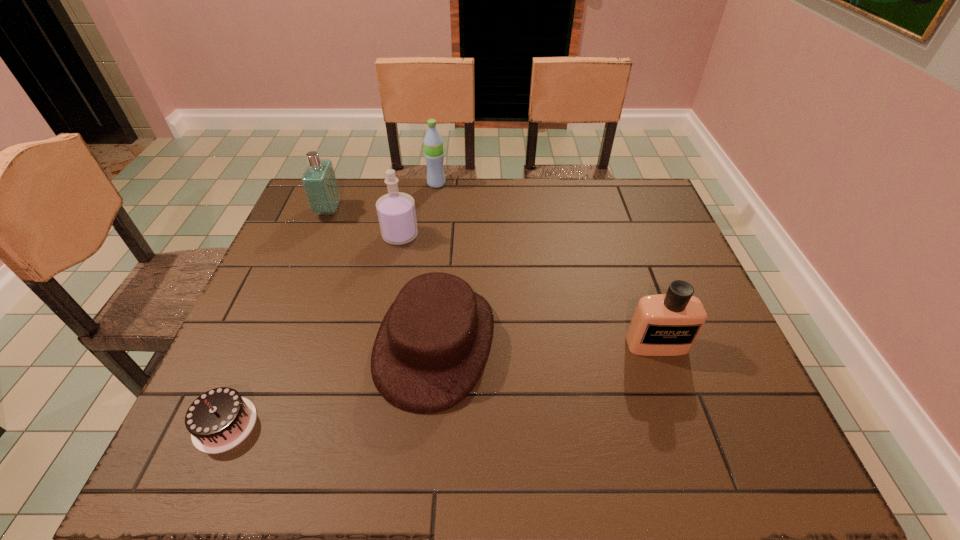
Where is `vacant space that satisfies the following two spatial constraints: 1. on the front label of the fifth nearest object; 2. on the back side of the second nearest perfume`? vacant space that satisfies the following two spatial constraints: 1. on the front label of the fifth nearest object; 2. on the back side of the second nearest perfume is located at coordinates (319, 235).

Identify the location of free space that satisfies the following two spatial constraints: 1. on the back side of the second perfume from right to left; 2. on the front label of the leftmost perfume. The width and height of the screenshot is (960, 540). (405, 211).

You are a GUI agent. You are given a task and a screenshot of the screen. Output one action in this format:
    pyautogui.click(x=<x>, y=<y>)
    Task: Click on the vacant area that satisfies the following two spatial constraints: 1. on the front label of the second perfume from right to left; 2. on the left side of the second farthest object
    The height and width of the screenshot is (540, 960).
    Given the screenshot: What is the action you would take?
    pyautogui.click(x=319, y=235)